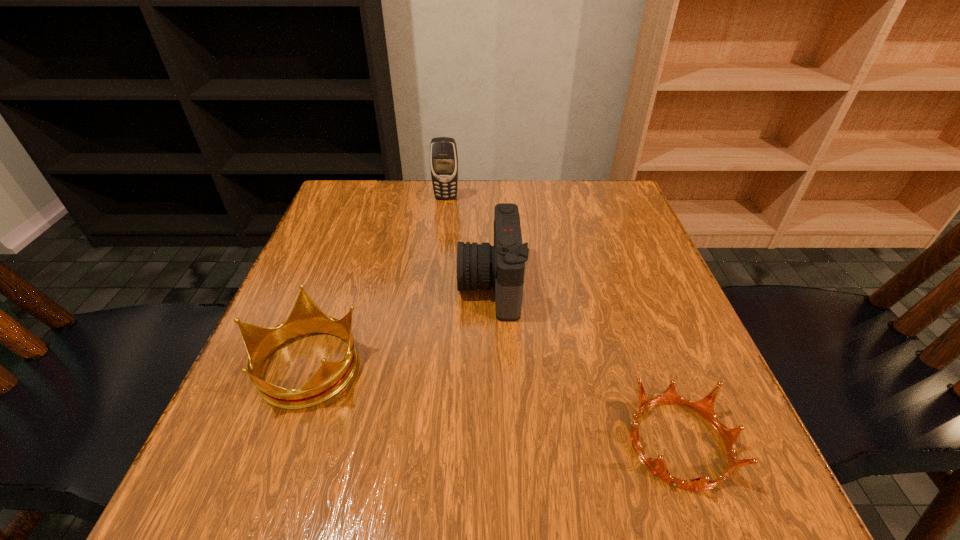
Find the location of a particular element. the second object from left to right is located at coordinates (443, 151).

Find the location of a particular element. the farthest object is located at coordinates (443, 151).

Image resolution: width=960 pixels, height=540 pixels. In order to click on camera in this screenshot , I will do `click(502, 266)`.

I want to click on the second tallest object, so click(x=502, y=266).

This screenshot has width=960, height=540. I want to click on the third tallest object, so click(x=306, y=317).

Locate an element on the screen. the left crown is located at coordinates (306, 317).

Locate an element on the screen. the rightmost object is located at coordinates (705, 407).

This screenshot has width=960, height=540. I want to click on the shorter crown, so click(x=705, y=407).

Locate an element on the screen. free space located on the front face of the cellular telephone is located at coordinates (439, 268).

Identify the location of vacant region located at the lens of the second farthest object. The height and width of the screenshot is (540, 960). point(353,285).